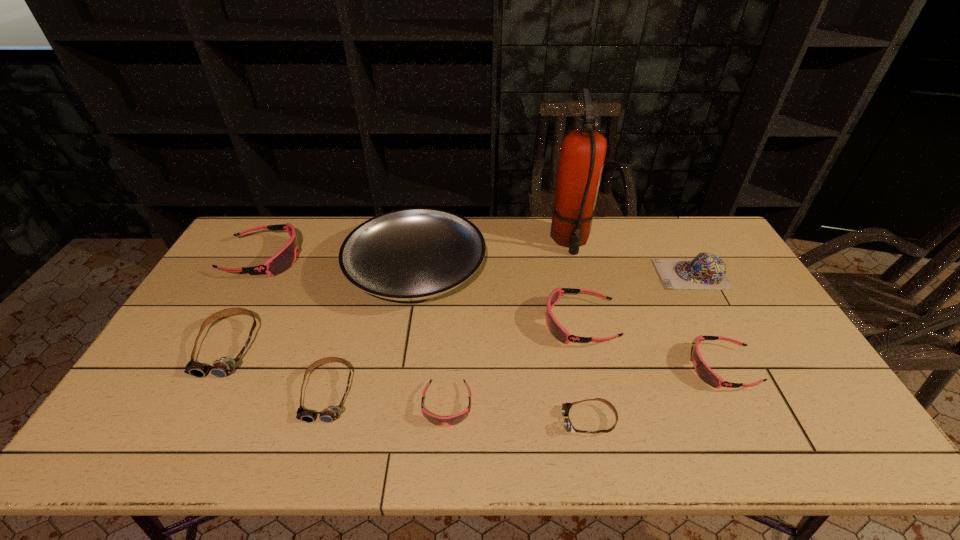
The width and height of the screenshot is (960, 540). I want to click on vacant space located on the front-facing side of the second biggest pink goggles, so click(x=466, y=323).

Identify the location of vacant space located on the front-facing side of the second biggest pink goggles. (425, 323).

Image resolution: width=960 pixels, height=540 pixels. Find the location of `vacant space located on the front-facing side of the second biggest pink goggles`. vacant space located on the front-facing side of the second biggest pink goggles is located at coordinates (503, 323).

Where is `vacant region located on the front-facing side of the biggest brown goggles`? The height and width of the screenshot is (540, 960). vacant region located on the front-facing side of the biggest brown goggles is located at coordinates pyautogui.click(x=201, y=399).

You are a GUI agent. You are given a task and a screenshot of the screen. Output one action in this format:
    pyautogui.click(x=<x>, y=<y>)
    Task: Click on the free space located on the front-facing side of the rightmost goggles
    The width and height of the screenshot is (960, 540).
    Given the screenshot: What is the action you would take?
    pyautogui.click(x=567, y=368)

Where is `vacant space located on the front-facing side of the rightmost goggles`? The image size is (960, 540). vacant space located on the front-facing side of the rightmost goggles is located at coordinates (589, 368).

You are a GUI agent. You are given a task and a screenshot of the screen. Output one action in this format:
    pyautogui.click(x=<x>, y=<y>)
    Task: Click on the vacant space located 0.180m on the front-facing side of the rightmost goggles
    This screenshot has width=960, height=540.
    Given the screenshot: What is the action you would take?
    pyautogui.click(x=623, y=368)

Identify the location of vacant region located on the front-facing side of the smallest brown goggles. (505, 421).

Find the location of a particular element. vacant region located 0.150m on the front-facing side of the smallest brown goggles is located at coordinates (501, 421).

Where is `vacant region located 0.140m on the front-facing side of the smallest brown goggles`? vacant region located 0.140m on the front-facing side of the smallest brown goggles is located at coordinates (505, 421).